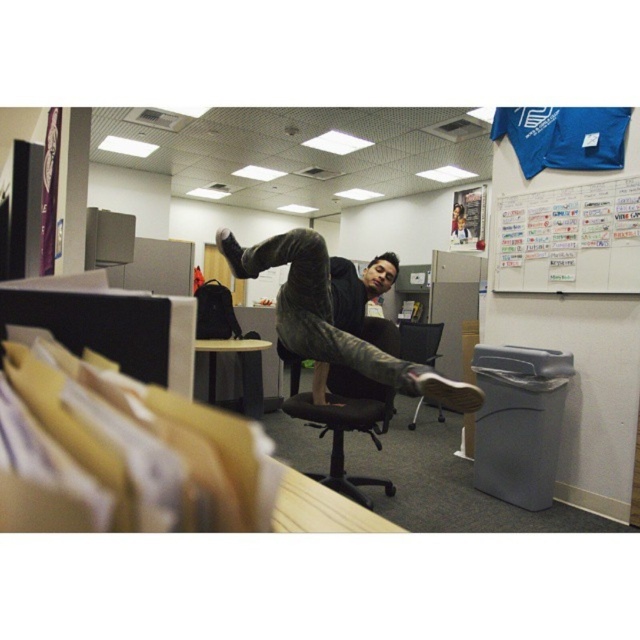
Between point (298, 368) and point (209, 342), which one is positioned in front?

Positioned in front is point (298, 368).

Does point (371, 397) come farther from viewer compared to point (260, 403)?

No, it is in front of (260, 403).

Where is `black fabric swivel chair at center`? This screenshot has width=640, height=640. black fabric swivel chair at center is located at coordinates (342, 420).

Does point (428, 369) come closer to viewer compared to point (250, 384)?

Yes, it is in front of point (250, 384).

Identify the location of dark gray jeans at center. point(330,321).

Which is below, black fabric swivel chair at center or black mesh office chair at center?

Positioned lower is black fabric swivel chair at center.

This screenshot has height=640, width=640. Describe the element at coordinates (342, 420) in the screenshot. I see `black fabric swivel chair at center` at that location.

Between point (360, 321) and point (426, 342), which one is positioned behind?

The point (426, 342) is more distant.

Where is `black fabric swivel chair at center`? The image size is (640, 640). black fabric swivel chair at center is located at coordinates (342, 420).